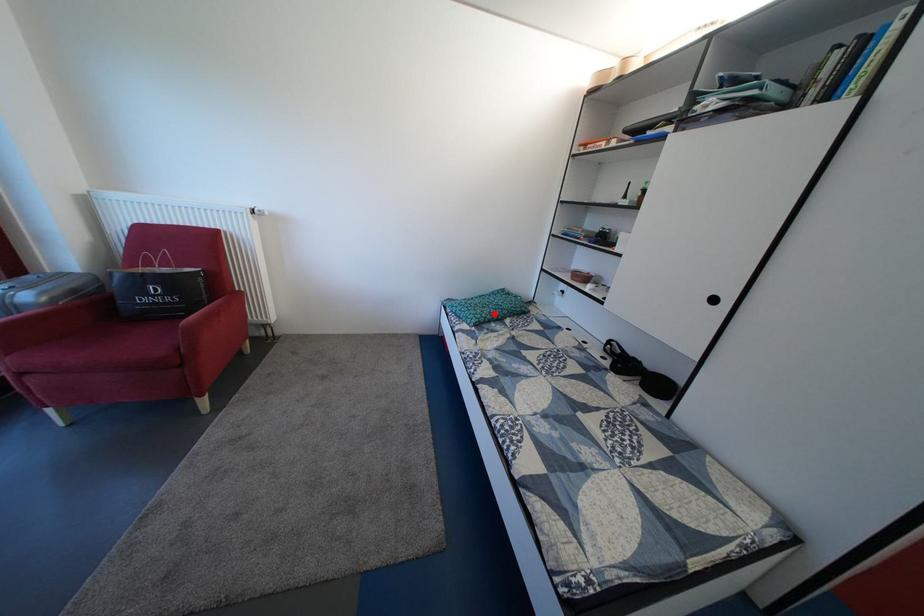
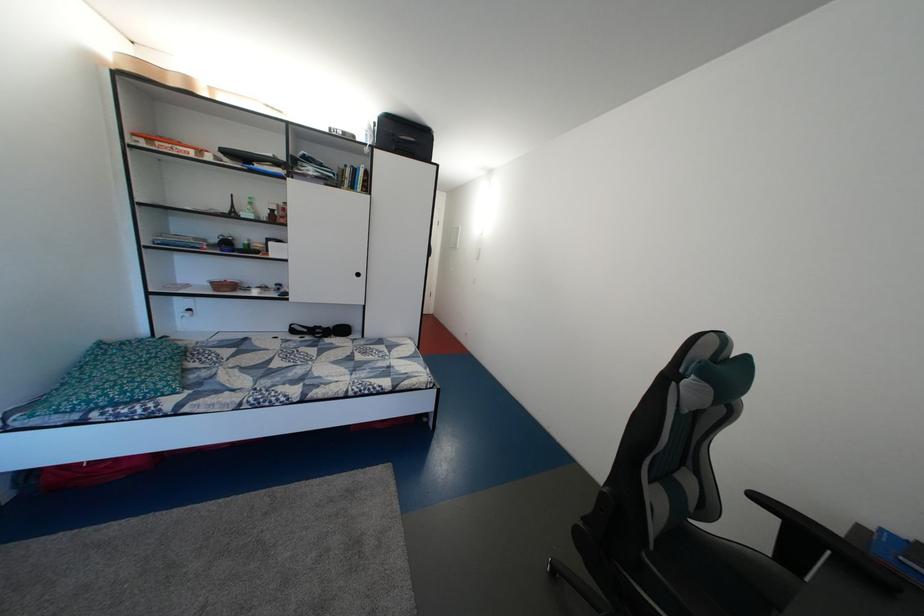
Locate, in the second image, the point that corresponds to the highlighted location in the first image.

(160, 376)